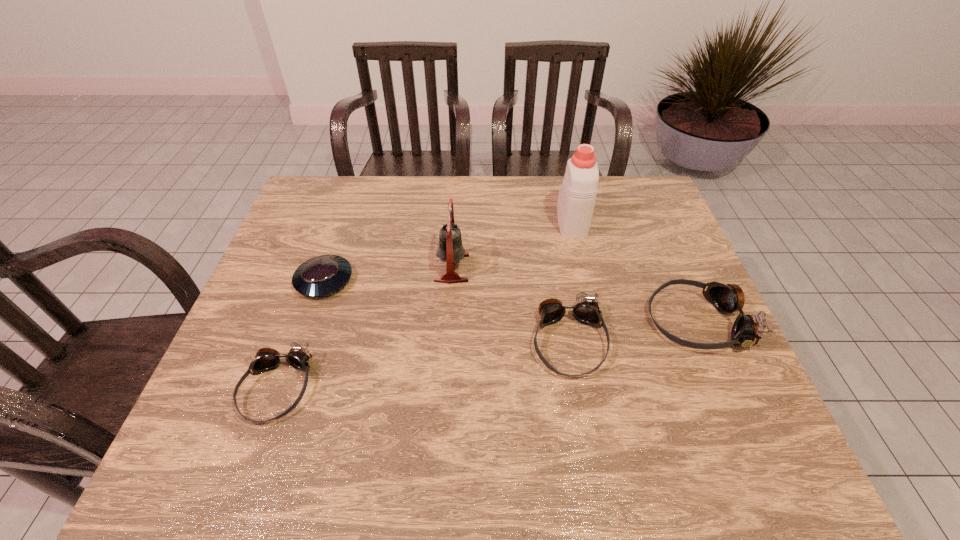
Find the location of a particular element. vacant space situated through the lenses of the second shortest goggles is located at coordinates (x=579, y=406).

The height and width of the screenshot is (540, 960). Identify the location of free space located through the lenses of the rightmost goggles. (555, 322).

Identify the location of free space located 0.170m through the lenses of the rightmost goggles. (580, 322).

This screenshot has height=540, width=960. Identify the location of free space located 0.380m through the lenses of the rightmost goggles. (495, 322).

You are a GUI agent. You are given a task and a screenshot of the screen. Output one action in this format:
    pyautogui.click(x=<x>, y=<y>)
    Task: Click on the free space located 0.080m on the handle side of the tallest object
    
    Given the screenshot: What is the action you would take?
    pyautogui.click(x=564, y=190)

The height and width of the screenshot is (540, 960). I want to click on free spot located 0.050m on the handle side of the tallest object, so click(565, 195).

Where is `vacant space located 0.160m on the handle side of the tallest object`? vacant space located 0.160m on the handle side of the tallest object is located at coordinates (562, 177).

Where is `vacant space located 0.210m on the back of the shortest object`? The height and width of the screenshot is (540, 960). vacant space located 0.210m on the back of the shortest object is located at coordinates (347, 215).

Where is `vacant area situated on the left of the second tallest object`? This screenshot has height=540, width=960. vacant area situated on the left of the second tallest object is located at coordinates (306, 268).

Locate an element on the screen. object located in the far edge section of the desktop is located at coordinates (576, 200).